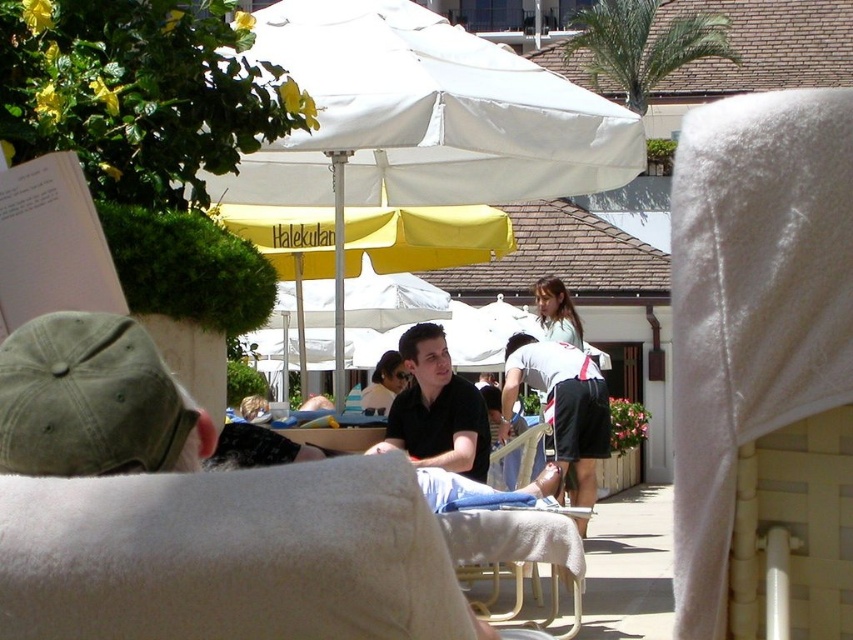
You are a photographer trying to capture a candid shot of the black matte shirt at center and the white cotton shorts at center. Since you want to make sure both are clearly visible in the frame, which object should you focus on to ensure clarity, considering their sizes?

The black matte shirt at center has a smaller size compared to white cotton shorts at center. Therefore, you should focus on the black matte shirt at center to ensure clarity since smaller objects require more precise focus to capture details clearly.

You are standing at the center of the image and want to find the black matte shirt at center. According to the coordinates provided, in which direction should you look to locate it?

The black matte shirt at center is located at coordinates point [436,410], which means it is to the right and slightly below the center of the image.

You are a photographer trying to capture a candid shot of both the black matte shirt at center and the light brown hair at center. Since you want to ensure both are in focus, which object should you adjust your camera focus on first?

The black matte shirt at center is closer to the viewer than light brown hair at center, so you should focus on the black matte shirt at center first to ensure both are in focus.